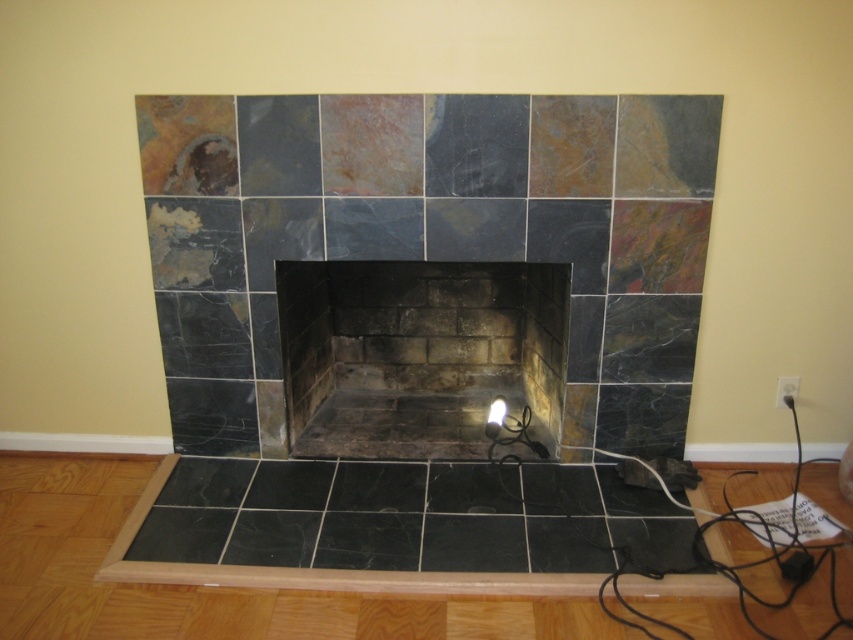
You are standing in front of the fireplace and see two points marked on the floor. The first point is at coordinate point (386, 440) and the second is at point (498, 403). Which point is closer to you?

Point (386, 440) is in front of point (498, 403), so it is closer to you.

You are standing in a room with the fireplace described. If you want to place a decorative item exactly at the center of the black slate fireplace at center, what coordinates should you aim for?

The coordinates for the center of the black slate fireplace at center are exactly at point (416, 353), so you should aim for those coordinates.

You are standing in front of a fireplace with a tiled surround. The tiles are arranged in a grid pattern with earthy tones on the upper section and darker black tiles below. There is a point marked at coordinates (x=416, y=353). What object is located at this point?

The point at coordinates (x=416, y=353) is where the black slate fireplace at center is located.